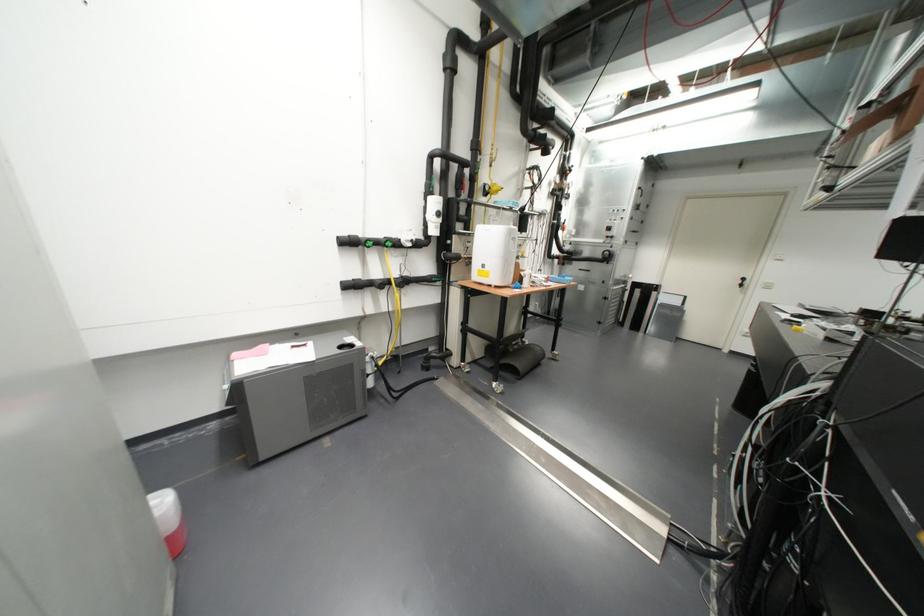
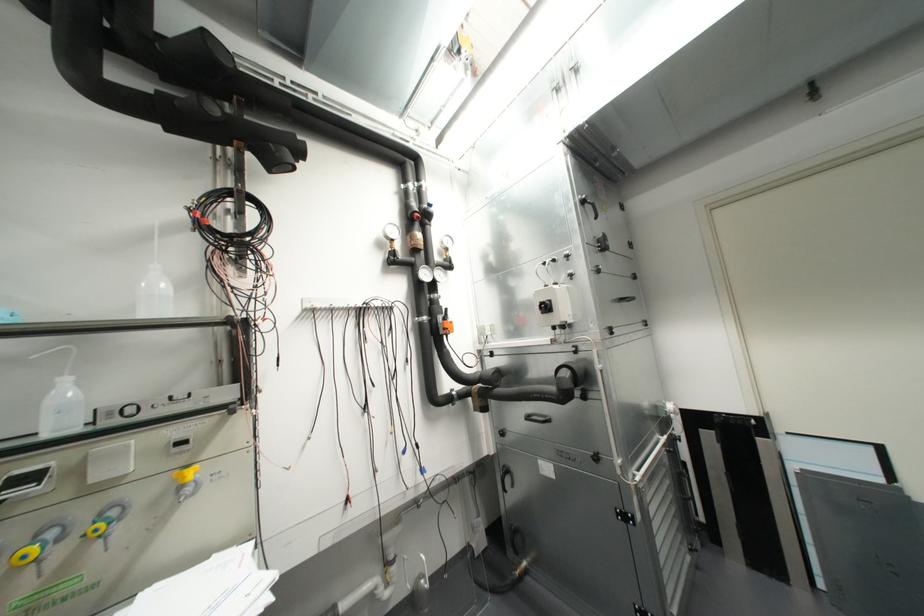
Where in the second image is the point corresponding to point (608, 228) from the first image?

(545, 307)